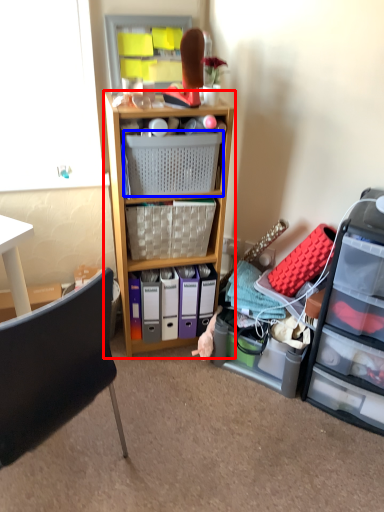
Question: Which of the following is the closest to the observer, shelf (highlighted by a red box) or picnic basket (highlighted by a blue box)?

Choices:
 (A) shelf
 (B) picnic basket

Answer: (A)